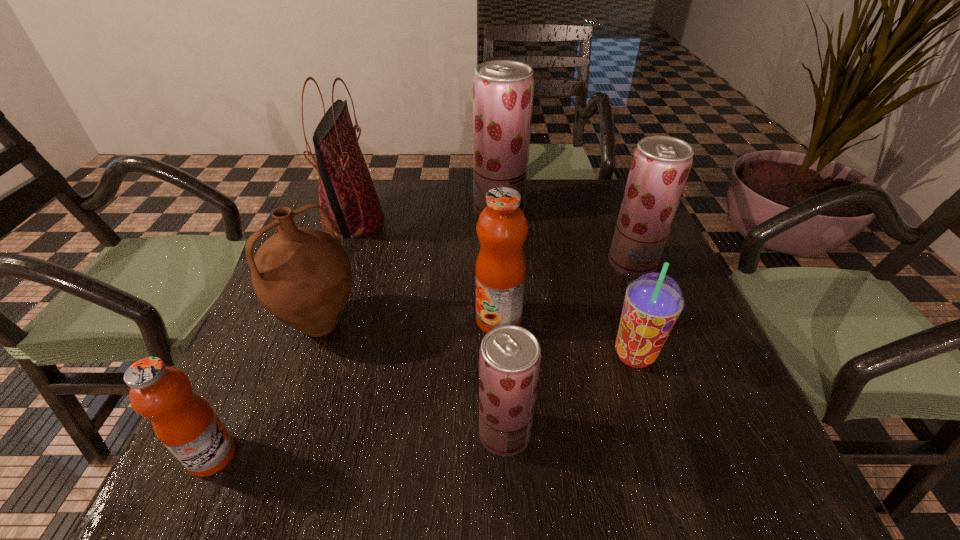
I want to click on the smaller orange fruit juice, so click(184, 422).

This screenshot has height=540, width=960. I want to click on the leftmost fruit juice, so click(x=184, y=422).

Where is `free location located on the left of the biggest strawberry fruit juice`? This screenshot has width=960, height=540. free location located on the left of the biggest strawberry fruit juice is located at coordinates (341, 210).

This screenshot has width=960, height=540. What are the coordinates of `vacant space situated on the front of the handbag` in the screenshot? It's located at click(x=336, y=268).

At what (x,y) coordinates should I click in order to perform the action: click on free spot located 0.270m on the front of the rightmost fruit juice. Please return your answer as a coordinate pair (x, y). The height and width of the screenshot is (540, 960). Looking at the image, I should click on (677, 377).

Find the location of `vacant space located on the front label of the third farthest fruit juice`. vacant space located on the front label of the third farthest fruit juice is located at coordinates (294, 320).

The height and width of the screenshot is (540, 960). I want to click on free location located 0.370m on the front label of the third farthest fruit juice, so click(299, 320).

Where is `free space located on the front label of the third farthest fruit juice`? free space located on the front label of the third farthest fruit juice is located at coordinates (323, 320).

This screenshot has height=540, width=960. Identify the location of vacant space located on the front of the brown pitcher. (292, 404).

Identify the location of free space located on the front of the smoothie. This screenshot has width=960, height=540. (649, 399).